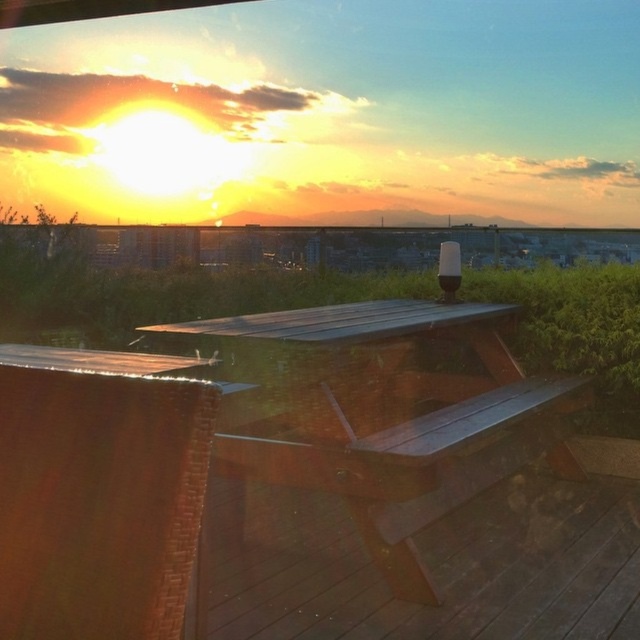
Question: Does brown wooden deck at center have a smaller size compared to dark brown wood picnic table at center?

Choices:
 (A) no
 (B) yes

Answer: (B)

Question: Estimate the real-world distances between objects in this image. Which object is closer to the dark brown wood picnic table at center?

Choices:
 (A) brown wooden deck at center
 (B) smooth wood table at center

Answer: (A)

Question: Is smooth wood table at center to the right of dark brown wood picnic table at center from the viewer's perspective?

Choices:
 (A) yes
 (B) no

Answer: (B)

Question: Is brown wooden deck at center positioned in front of dark brown wood picnic table at center?

Choices:
 (A) yes
 (B) no

Answer: (A)

Question: Which point is farther from the camera taking this photo?

Choices:
 (A) (317, 436)
 (B) (81, 460)

Answer: (A)

Question: Which is farther from the dark brown wood picnic table at center?

Choices:
 (A) smooth wood table at center
 (B) brown wooden deck at center

Answer: (A)